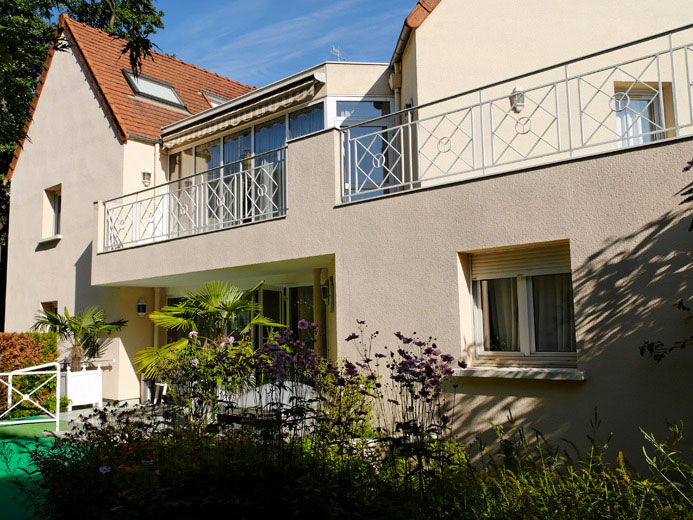
Identify the location of plant holder. The width and height of the screenshot is (693, 520). (89, 393).